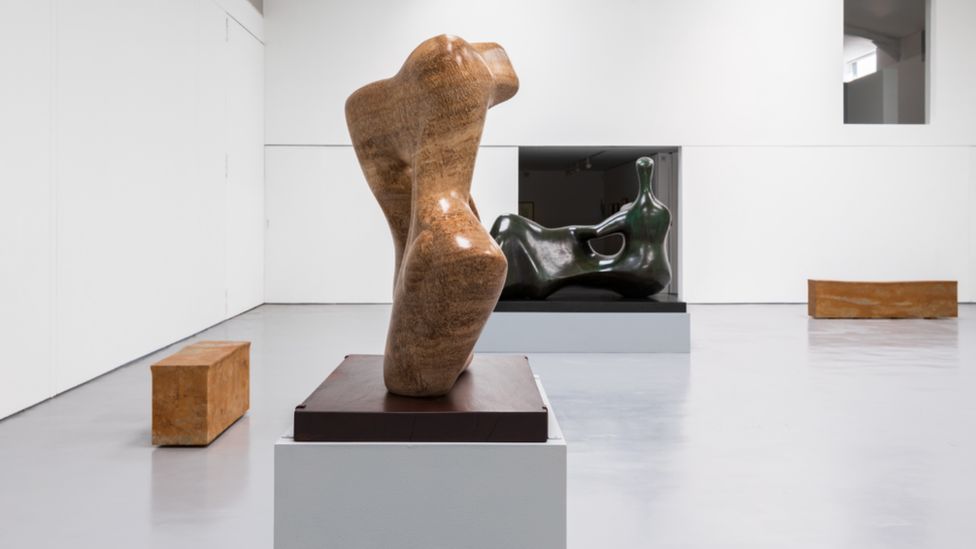
Image resolution: width=976 pixels, height=549 pixels. I want to click on white pedestal, so click(x=489, y=492).